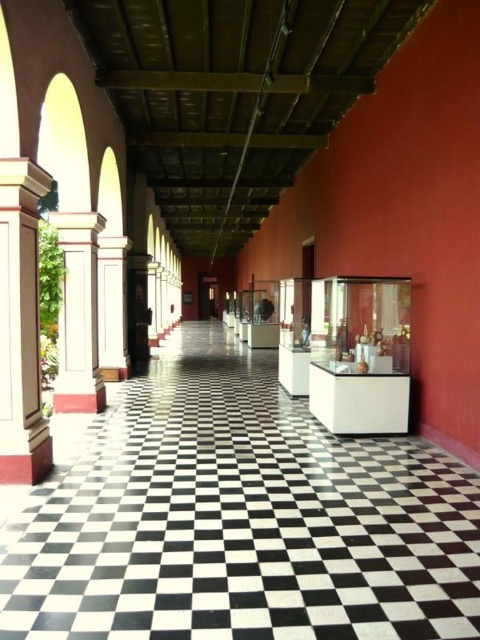
Question: Does smooth white column at left appear on the right side of white painted wood column at left?

Choices:
 (A) no
 (B) yes

Answer: (B)

Question: Among these objects, which one is farthest from the camera?

Choices:
 (A) white painted wood column at left
 (B) smooth white column at left

Answer: (A)

Question: Which of the following is the farthest from the observer?

Choices:
 (A) (87, 266)
 (B) (33, 216)

Answer: (A)

Question: Does smooth white column at left have a larger size compared to white painted wood column at left?

Choices:
 (A) no
 (B) yes

Answer: (A)

Question: Is smooth white column at left positioned in front of white painted wood column at left?

Choices:
 (A) yes
 (B) no

Answer: (A)